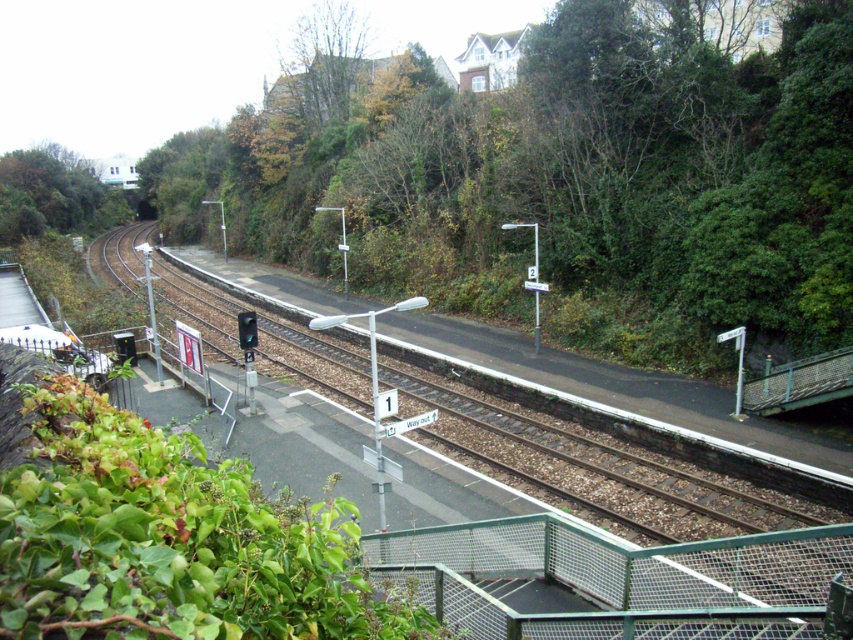
You are standing on the railway station platform and looking towards the tracks. You notice two green leafy trees in the upper part of the image. Which tree is closer to you, the green leafy tree at upper center or the green leafy tree at upper left?

The green leafy tree at upper center is positioned over the green leafy tree at upper left, meaning it is closer to you.

You are standing on the railway station platform and want to find the way out. There is a green leafy tree at upper left marked by point (53, 195). Which direction should you walk to reach the Way out sign?

The Way out sign is located near the edge of the platform on the left side, while the green leafy tree at upper left is at point (53, 195). Since the tree is at the upper left corner, walking towards the opposite direction of the tree would lead you to the Way out sign on the left edge.

You are standing on the railway station platform in the green wooded area. You want to walk to the point marked as point (35, 204). If your walking speed is 1.5 meters per second, how many seconds will it take you to reach the point?

The distance between you and point (35, 204) is 80.01 meters. At a walking speed of 1.5 meters per second, it will take approximately 53.34 seconds to reach the point.